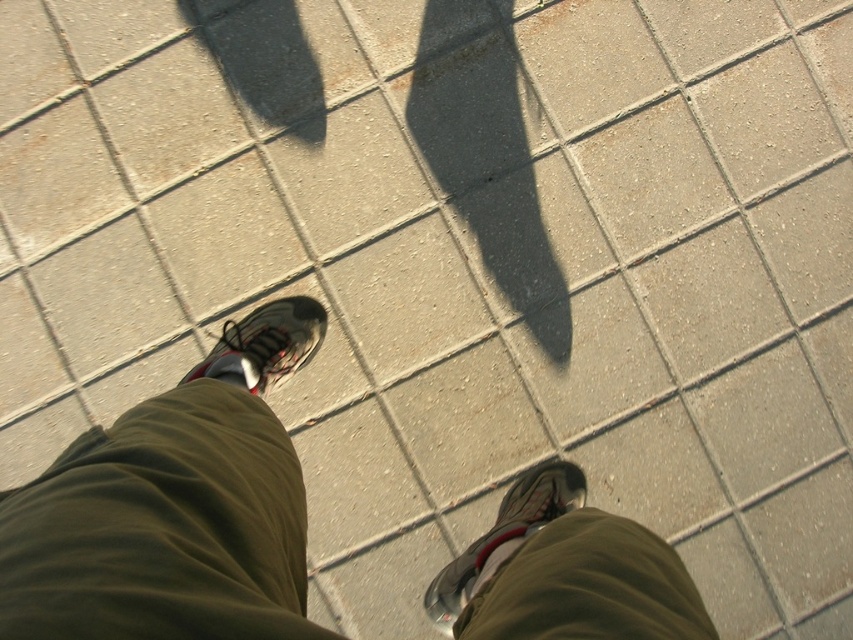
Question: Where is khaki cotton pants at center located in relation to khaki pants at center in the image?

Choices:
 (A) above
 (B) below

Answer: (A)

Question: Among these objects, which one is farthest from the camera?

Choices:
 (A) khaki cotton pants at center
 (B) matte black shoe at center
 (C) khaki pants at center

Answer: (B)

Question: Which point is closer to the camera?

Choices:
 (A) shiny metallic shoe at lower center
 (B) khaki pants at center
 (C) matte black shoe at center

Answer: (B)

Question: Which object is positioned closest to the shiny metallic shoe at lower center?

Choices:
 (A) khaki cotton pants at center
 (B) matte black shoe at center
 (C) khaki pants at center

Answer: (A)

Question: Can you confirm if khaki pants at center is bigger than matte black shoe at center?

Choices:
 (A) no
 (B) yes

Answer: (B)

Question: Is khaki cotton pants at center positioned before shiny metallic shoe at lower center?

Choices:
 (A) yes
 (B) no

Answer: (A)